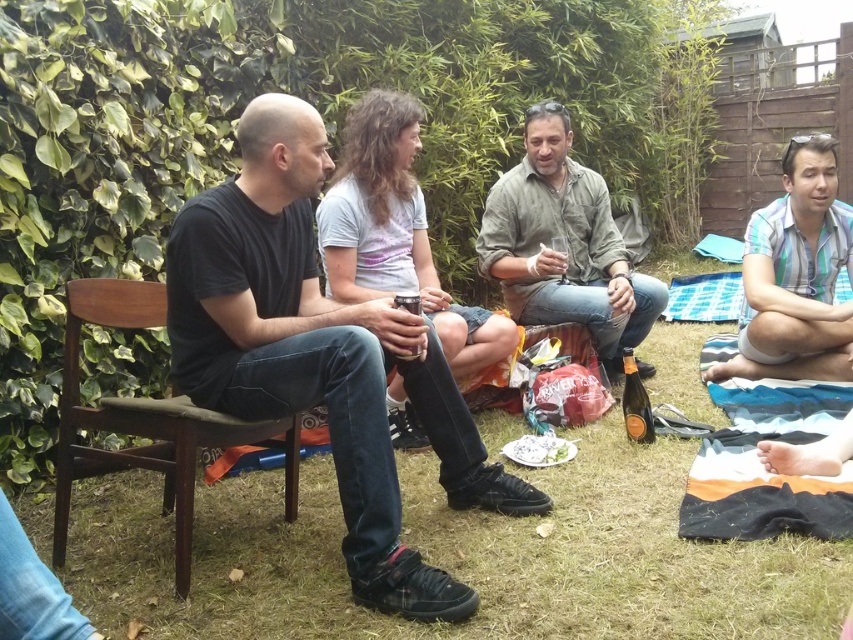
Consider the image. You are planning to take a photo of the black matte shirt at left and the blue striped shirt at lower right. To ensure both are in the frame, should you position the camera to the left or to the right of the two people?

To include both the black matte shirt at left and the blue striped shirt at lower right in the frame, position the camera to the right of the two people. This way, the camera can capture the black matte shirt at left, which is to the left of the blue striped shirt at lower right, ensuring both are visible.

You are planning to set up a small picnic table in the backyard shown. The picnic table requires a space that is wider than the black matte shirt at left. Is there enough space on the green grass at lower left to accommodate it?

The green grass at lower left might be wider than the black matte shirt at left, so there is a possibility that the picnic table can fit, but it depends on the exact measurements.